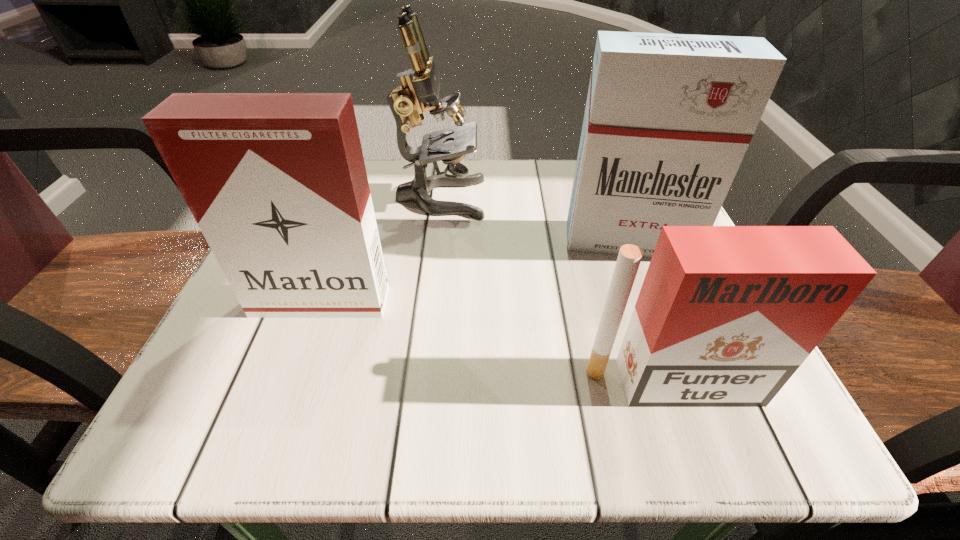
At what (x,y) coordinates should I click in order to perform the action: click on free spot that satisfies the following two spatial constraints: 1. on the back side of the third nearest object; 2. at the eyepieces of the microscope. Please return your answer as a coordinate pair (x, y). Looking at the image, I should click on (612, 198).

This screenshot has height=540, width=960. Find the location of `free space that satisfies the following two spatial constraints: 1. at the eyepieces of the microscope; 2. on the left side of the second farthest object`. free space that satisfies the following two spatial constraints: 1. at the eyepieces of the microscope; 2. on the left side of the second farthest object is located at coordinates (436, 240).